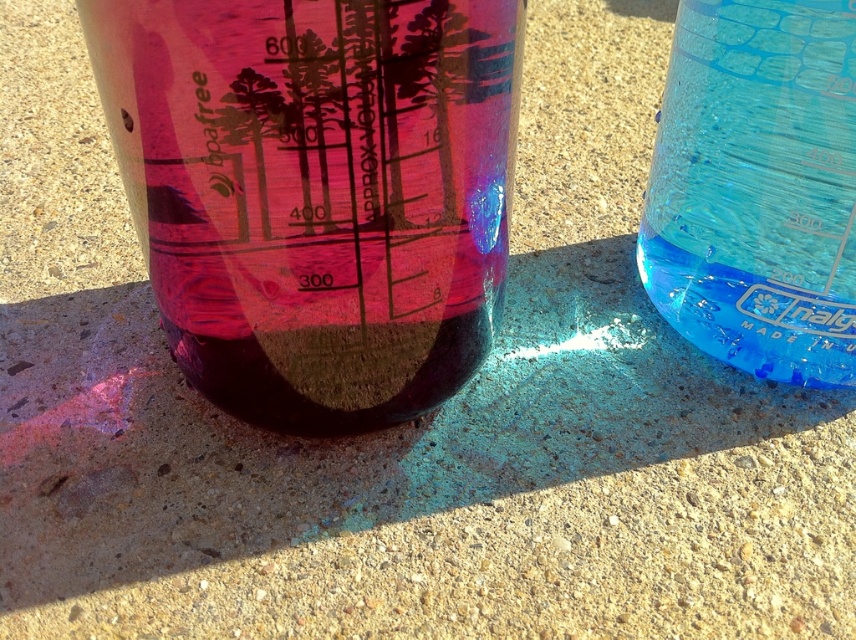
Question: Which point is farther to the camera?

Choices:
 (A) transparent plastic beaker at left
 (B) transparent blue beaker at right

Answer: (B)

Question: Considering the relative positions of transparent plastic beaker at left and transparent blue beaker at right in the image provided, where is transparent plastic beaker at left located with respect to transparent blue beaker at right?

Choices:
 (A) above
 (B) below

Answer: (B)

Question: Which point is closer to the camera taking this photo?

Choices:
 (A) (687, 125)
 (B) (361, 419)

Answer: (B)

Question: Is transparent plastic beaker at left wider than transparent blue beaker at right?

Choices:
 (A) yes
 (B) no

Answer: (A)

Question: Which of the following is the farthest from the observer?

Choices:
 (A) transparent blue beaker at right
 (B) transparent plastic beaker at left

Answer: (A)

Question: Where is transparent plastic beaker at left located in relation to transparent blue beaker at right in the image?

Choices:
 (A) below
 (B) above

Answer: (A)